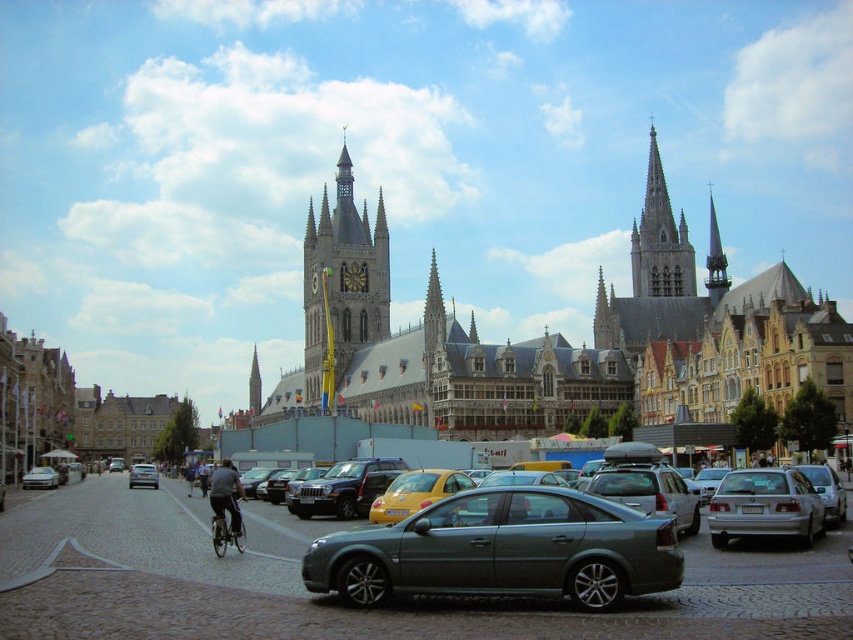
You are a delivery driver who needs to park your silver metallic sedan at right in a spot that can only accommodate vehicles taking up as much space as the silver metallic bicycle at center. Can your car fit in that spot?

The silver metallic sedan at right occupies less space than the silver metallic bicycle at center, so yes, the car can fit in the parking spot designed for the bicycle.

You are a pedestrian standing at the edge of the cobblestone street. You see the silver metallic sedan at right and the silver metallic bicycle at center. Which object is nearer to you?

The silver metallic sedan at right is closer to the viewer than the silver metallic bicycle at center.